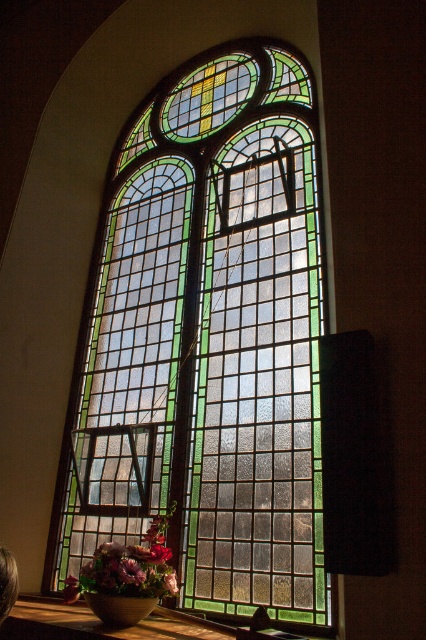
You are standing in front of the stained glass window at center and want to place a new vase on the wooden surface where the matte floral arrangement at lower left is currently located. Can you move the existing arrangement to make space without moving the window?

The stained glass window at center is in front of the matte floral arrangement at lower left, so you can move the arrangement from its current position behind the window to another spot on the wooden surface to make space for the new vase.

You are standing in a room and want to take a closer look at the stained glass window at center. Based on the distance provided, do you think you can comfortably walk up to it without any obstacles?

The stained glass window at center is 26.02 meters away from the viewer, which is a considerable distance. Walking that far might be challenging without obstacles, so it depends on the room layout. However, the description does not mention any obstacles, so assuming a clear path, you could walk up to it.

You are standing in front of the stained glass window at center and want to place a small vase on the floor between it and the matte floral arrangement at lower left. Can you estimate how much space you have to work with?

The distance between the stained glass window at center and the matte floral arrangement at lower left is 12.13 meters, so there is ample space to place the vase between them.